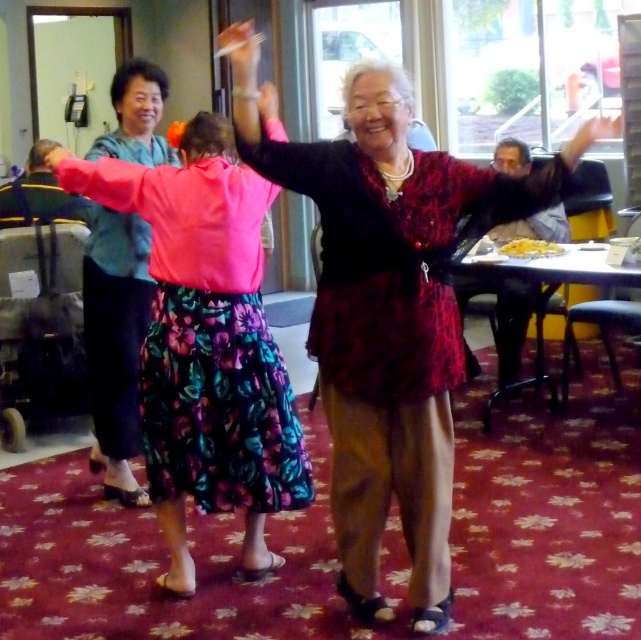
Question: Does yellow creamy food at center have a lesser width compared to pink fabric hand at upper center?

Choices:
 (A) yes
 (B) no

Answer: (B)

Question: Which object is the farthest from the floral skirt at center?

Choices:
 (A) matte black hand at upper left
 (B) matte red blouse at center
 (C) yellow creamy food at center
 (D) white matte paper at upper center

Answer: (C)

Question: Is floral fabric dress at center bigger than matte black hand at upper left?

Choices:
 (A) no
 (B) yes

Answer: (B)

Question: Can you confirm if matte red blouse at center is positioned below floral fabric dress at center?

Choices:
 (A) no
 (B) yes

Answer: (B)

Question: Which of the following is the farthest from the observer?

Choices:
 (A) (520, 241)
 (B) (590, 129)
 (C) (274, 108)

Answer: (A)

Question: Which point is farther to the camera?

Choices:
 (A) (328, 330)
 (B) (106, 410)
 (C) (238, 52)

Answer: (B)